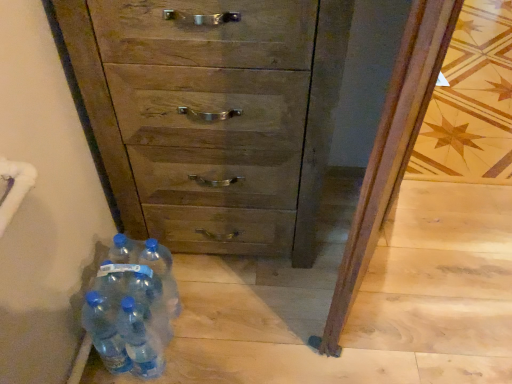
Where is `free space to the right of blue translucent bottle at lower left, the fifth bottle positioned from the left`? The width and height of the screenshot is (512, 384). free space to the right of blue translucent bottle at lower left, the fifth bottle positioned from the left is located at coordinates (224, 311).